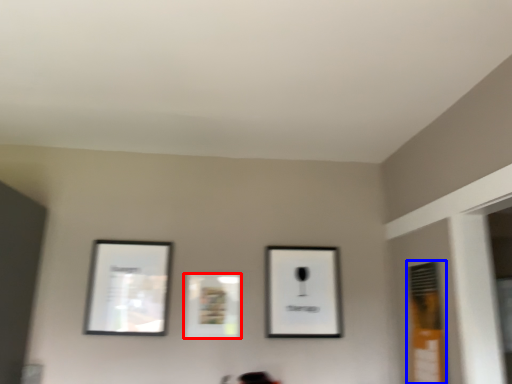
Question: Which of the following is the farthest to the observer, picture frame (highlighted by a red box) or window (highlighted by a blue box)?

Choices:
 (A) picture frame
 (B) window

Answer: (A)